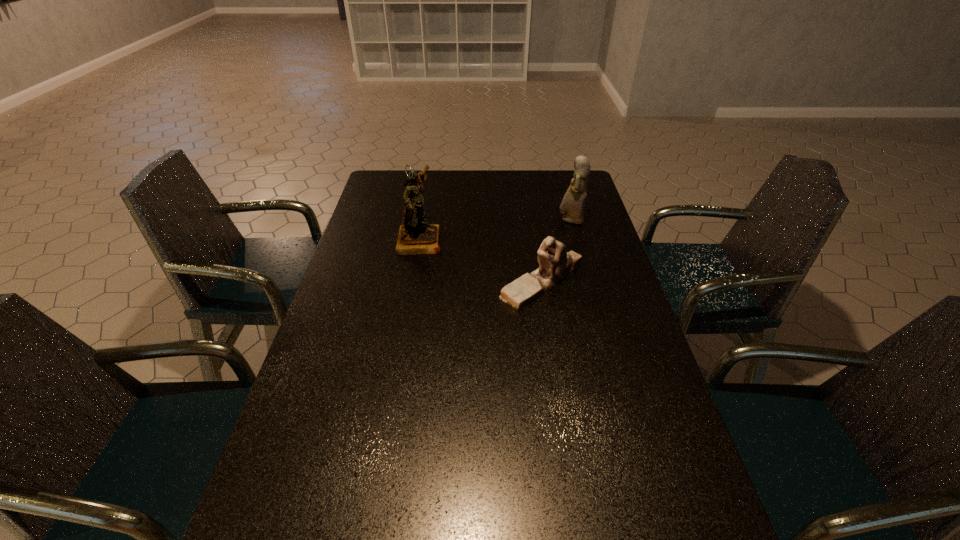
Identify the location of the leftmost object. This screenshot has width=960, height=540. (416, 236).

The image size is (960, 540). Identify the location of the nearest object. pos(555,262).

Locate an element on the screen. This screenshot has width=960, height=540. the nearest figurine is located at coordinates (555, 262).

You are a GUI agent. You are given a task and a screenshot of the screen. Output one action in this format:
    pyautogui.click(x=<x>, y=<y>)
    Task: Click on the free space located on the front-facing side of the leftmost figurine
    
    Given the screenshot: What is the action you would take?
    pyautogui.click(x=466, y=240)

I want to click on free space located on the front-facing side of the nearest figurine, so click(443, 281).

Locate an element on the screen. The height and width of the screenshot is (540, 960). vacant space located on the front-facing side of the nearest figurine is located at coordinates (410, 281).

The width and height of the screenshot is (960, 540). I want to click on free space located on the front-facing side of the nearest figurine, so click(x=475, y=281).

This screenshot has width=960, height=540. What are the coordinates of `object that is positioned at the left edge` in the screenshot? It's located at (416, 236).

You are a GUI agent. You are given a task and a screenshot of the screen. Output one action in this format:
    pyautogui.click(x=<x>, y=<y>)
    Task: Click on the vacant area at the far edge of the desktop
    This screenshot has height=540, width=960.
    Given the screenshot: What is the action you would take?
    pyautogui.click(x=525, y=188)

What are the coordinates of `free space at the left edge of the desktop` in the screenshot? It's located at pos(347,455).